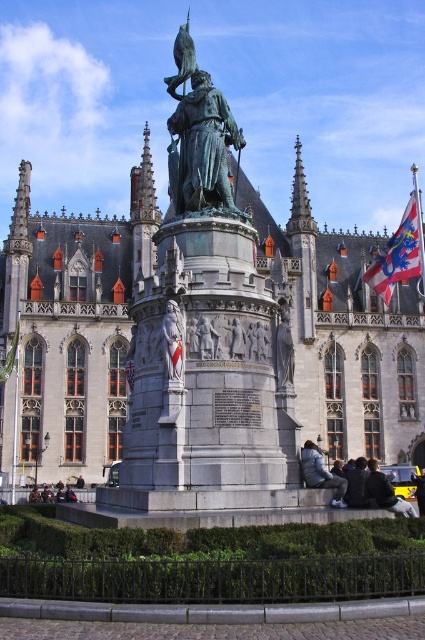
Question: Which is farther from the bronze statue at center?

Choices:
 (A) dark gray jacket at lower right
 (B) dark gray fabric jacket at lower right
 (C) silky blue flag at upper right

Answer: (C)

Question: Can you confirm if dark gray jacket at lower right is positioned to the left of bronze relief sculpture at center?

Choices:
 (A) yes
 (B) no

Answer: (B)

Question: Can you confirm if bronze relief sculpture at center is thinner than gray stone relief at center?

Choices:
 (A) yes
 (B) no

Answer: (B)

Question: Which of these objects is positioned closest to the white fabric flag at center?

Choices:
 (A) silky blue flag at upper right
 (B) gray stone relief at center

Answer: (B)

Question: Considering the relative positions of bronze relief sculpture at center and white fabric flag at center in the image provided, where is bronze relief sculpture at center located with respect to white fabric flag at center?

Choices:
 (A) below
 (B) above

Answer: (B)

Question: Which object is the closest to the stone gray building at center?

Choices:
 (A) white fabric flag at center
 (B) gray stone relief at center
 (C) green patinated bronze statue at center
 (D) dark gray fabric jacket at lower right

Answer: (C)